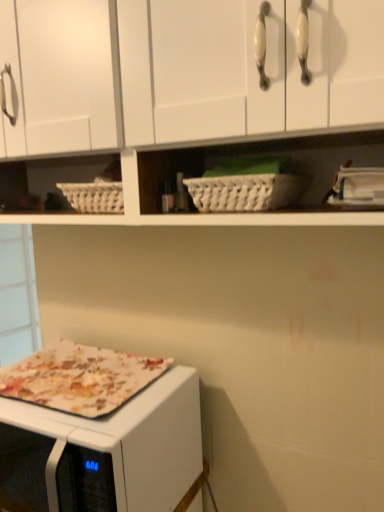
Where is `free space above floral fabric microwave oven at lower left (from a real-world perspective)`? The image size is (384, 512). free space above floral fabric microwave oven at lower left (from a real-world perspective) is located at coordinates (62, 391).